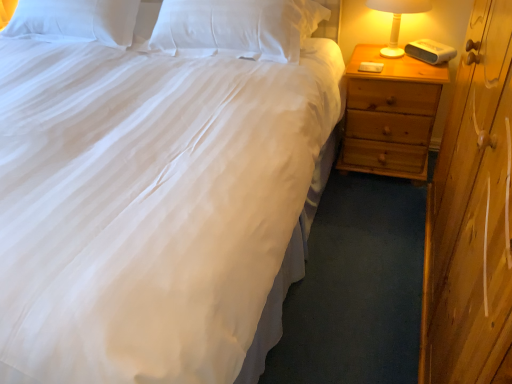
Question: Is white soft pillow at upper center, which is the 1th pillow in right-to-left order, not inside light brown wood nightstand at right?

Choices:
 (A) yes
 (B) no

Answer: (A)

Question: Is white soft pillow at upper center, which is the 1th pillow in right-to-left order, shorter than light brown wood nightstand at right?

Choices:
 (A) yes
 (B) no

Answer: (A)

Question: Can you confirm if white soft pillow at upper center, the 2th pillow in the left-to-right sequence, is bigger than light brown wood nightstand at right?

Choices:
 (A) no
 (B) yes

Answer: (A)

Question: Does white soft pillow at upper center, the 2th pillow in the left-to-right sequence, have a lesser width compared to light brown wood nightstand at right?

Choices:
 (A) yes
 (B) no

Answer: (A)

Question: From the image's perspective, would you say white soft pillow at upper center, the 2th pillow in the left-to-right sequence, is positioned over light brown wood nightstand at right?

Choices:
 (A) no
 (B) yes

Answer: (B)

Question: From the image's perspective, is white plastic lamp at right positioned above or below light brown wood nightstand at right?

Choices:
 (A) above
 (B) below

Answer: (A)

Question: In the image, is white plastic lamp at right positioned in front of or behind light brown wood nightstand at right?

Choices:
 (A) behind
 (B) front

Answer: (B)

Question: Based on their sizes in the image, would you say white plastic lamp at right is bigger or smaller than light brown wood nightstand at right?

Choices:
 (A) big
 (B) small

Answer: (B)

Question: Is white plastic lamp at right inside the boundaries of light brown wood nightstand at right, or outside?

Choices:
 (A) outside
 (B) inside

Answer: (A)

Question: From a real-world perspective, relative to light brown wood nightstand at right, is white soft pillow at upper left, acting as the 1th pillow starting from the left, vertically above or below?

Choices:
 (A) below
 (B) above

Answer: (B)

Question: Does point (77, 34) appear closer or farther from the camera than point (426, 102)?

Choices:
 (A) farther
 (B) closer

Answer: (A)

Question: Is white soft pillow at upper left, the second pillow from the right, bigger or smaller than light brown wood nightstand at right?

Choices:
 (A) big
 (B) small

Answer: (B)

Question: Is white soft pillow at upper left, the second pillow from the right, inside the boundaries of light brown wood nightstand at right, or outside?

Choices:
 (A) inside
 (B) outside

Answer: (B)

Question: Looking at the image, does white soft pillow at upper center, which is the 1th pillow in right-to-left order, seem bigger or smaller compared to white plastic lamp at right?

Choices:
 (A) big
 (B) small

Answer: (A)

Question: Is white soft pillow at upper center, the 2th pillow in the left-to-right sequence, spatially inside white plastic lamp at right, or outside of it?

Choices:
 (A) outside
 (B) inside

Answer: (A)